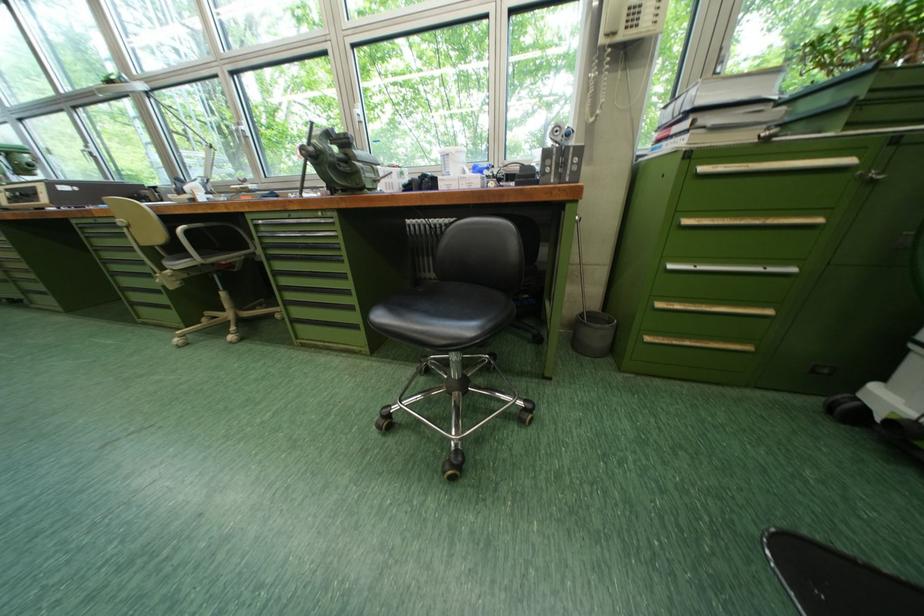
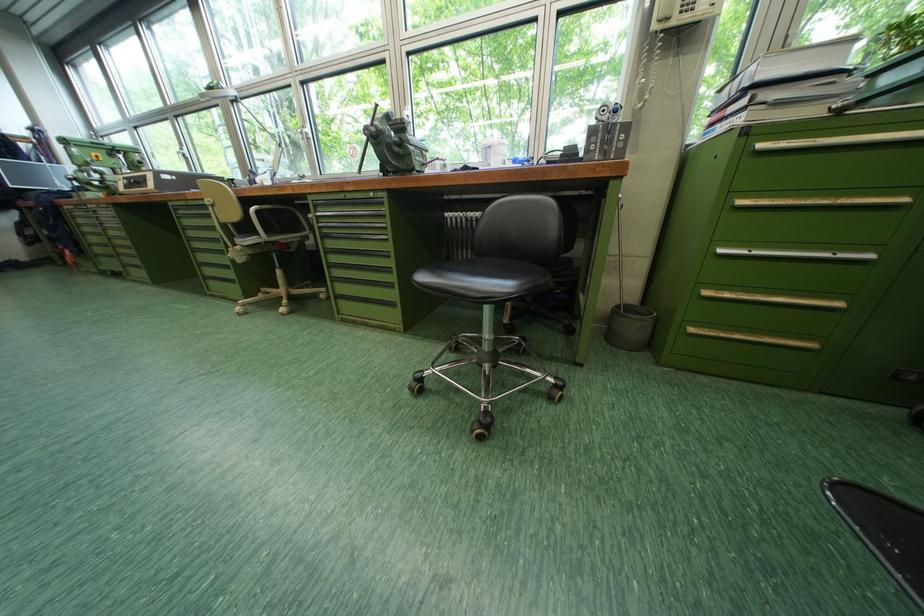
Which direction would the cameraman need to move to produce the second image?

The cameraman walked toward left, backward.